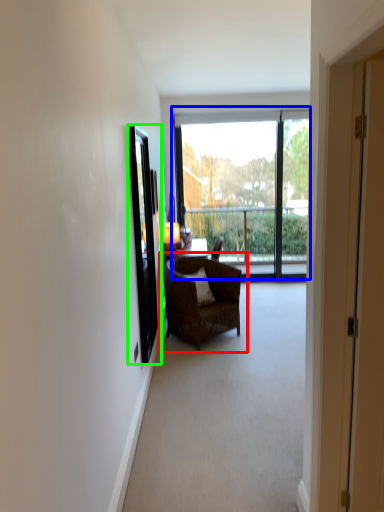
Question: Which object is positioned farthest from chair (highlighted by a red box)? Select from window (highlighted by a blue box) and screen door (highlighted by a green box).

Choices:
 (A) window
 (B) screen door

Answer: (A)